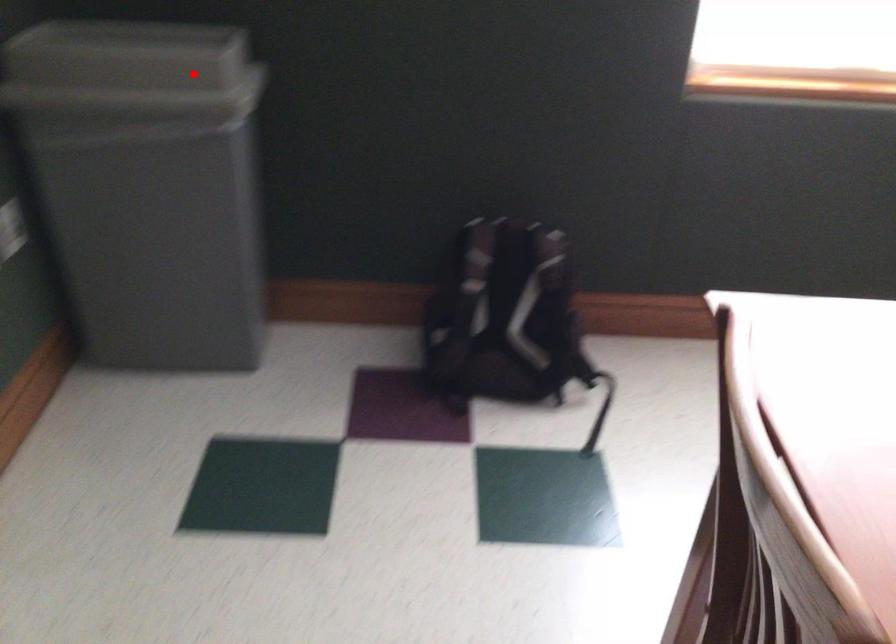
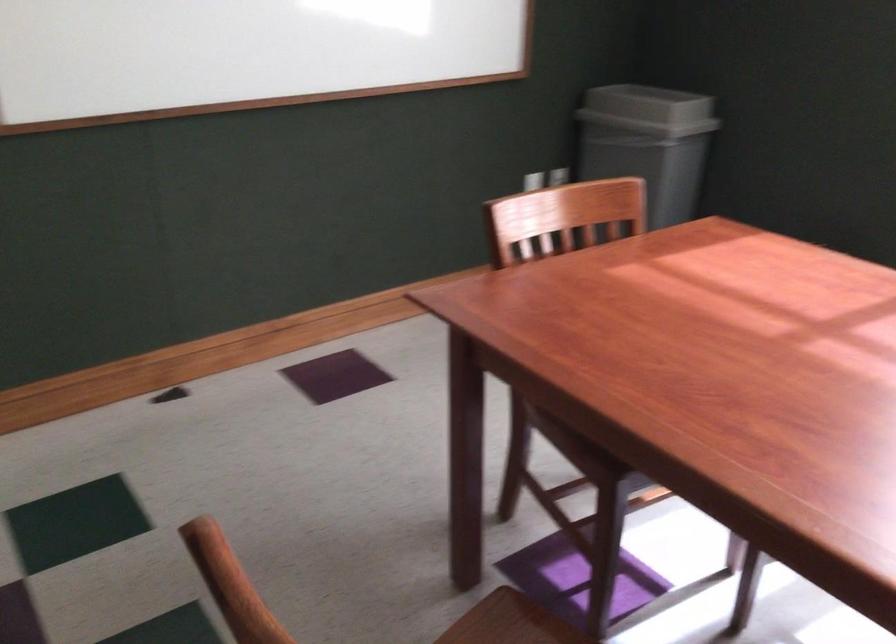
Question: I am providing you with two images of the same scene from different viewpoints. A red point is shown in image1. For the corresponding object point in image2, is it positioned nearer or farther from the camera?

Choices:
 (A) Nearer
 (B) Farther

Answer: (B)